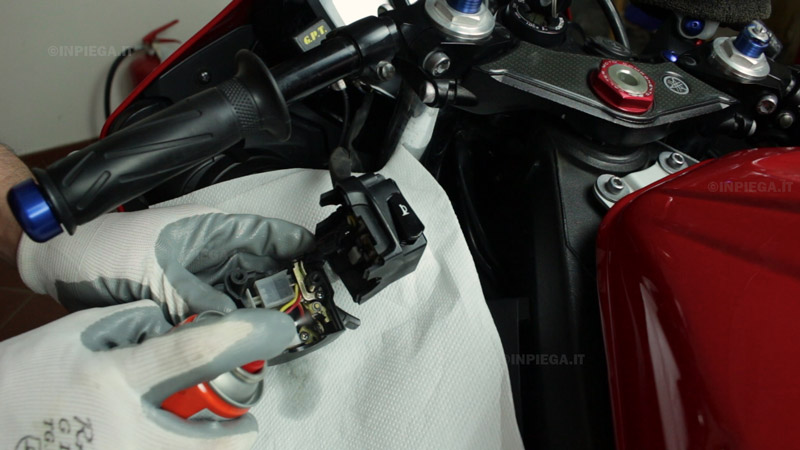
This screenshot has width=800, height=450. Find the location of `wires`. wires is located at coordinates (290, 303).